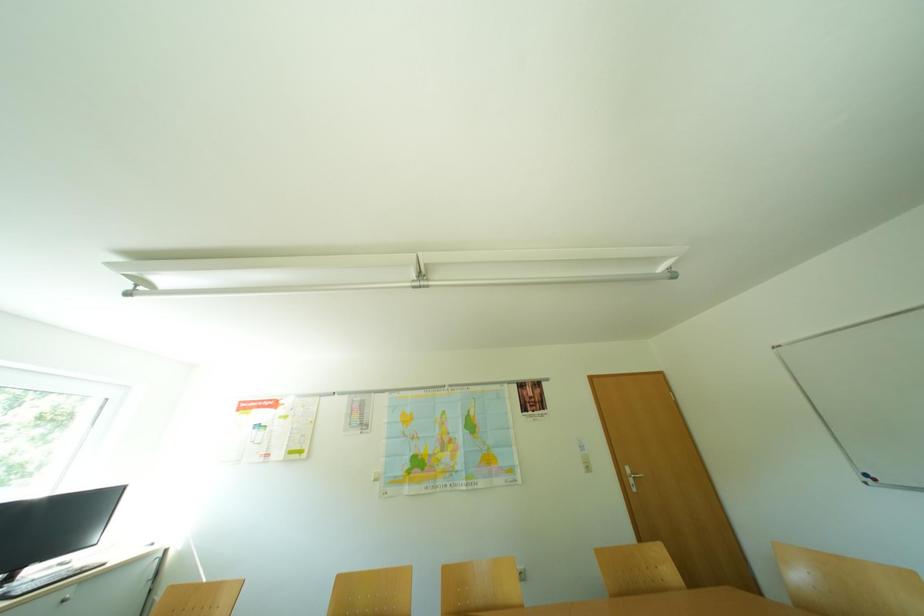
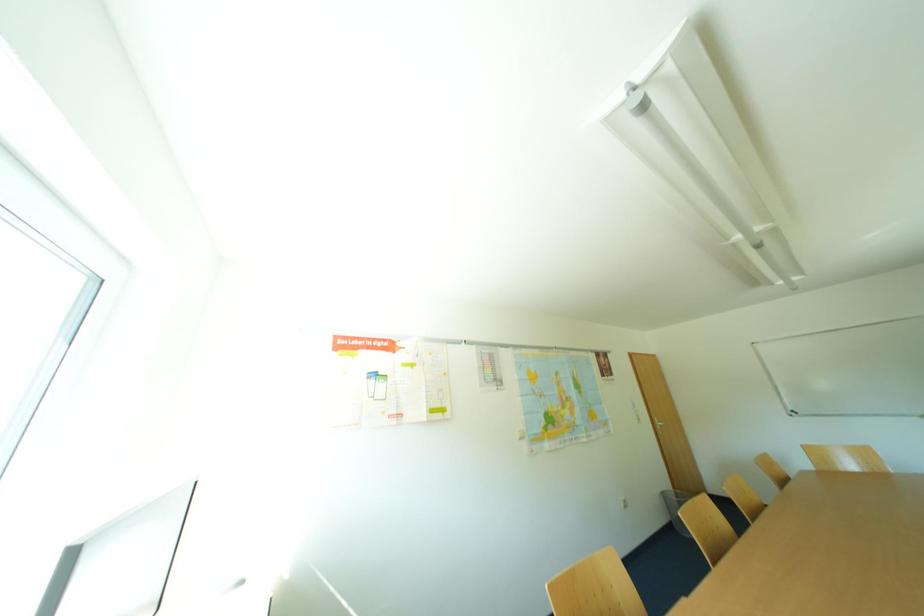
Question: Which direction would the cameraman need to move to produce the second image? Reply with the corresponding letter.

Choices:
 (A) Left
 (B) Right
 (C) Forward
 (D) Backward

Answer: (A)